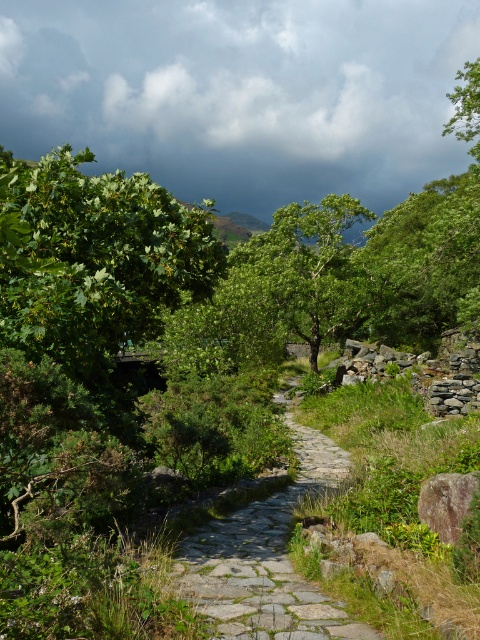
Question: Can you confirm if dark gray cloud at upper center is positioned to the left of stone paved path at center?

Choices:
 (A) no
 (B) yes

Answer: (B)

Question: Which is nearer to the green leafy tree at center?

Choices:
 (A) dark gray cloud at upper center
 (B) stone paved path at center
 (C) gray rough rock at center-right

Answer: (B)

Question: Which of these objects is positioned farthest from the stone paved path at center?

Choices:
 (A) dark gray cloud at upper center
 (B) gray rough rock at center-right

Answer: (A)

Question: Considering the relative positions of dark gray cloud at upper center and gray rough rock at center-right in the image provided, where is dark gray cloud at upper center located with respect to gray rough rock at center-right?

Choices:
 (A) below
 (B) above

Answer: (B)

Question: Which point is closer to the camera taking this photo?

Choices:
 (A) (299, 316)
 (B) (423, 520)
 (C) (228, 636)
 (D) (458, 54)

Answer: (C)

Question: Is dark gray cloud at upper center behind stone paved path at center?

Choices:
 (A) no
 (B) yes

Answer: (B)